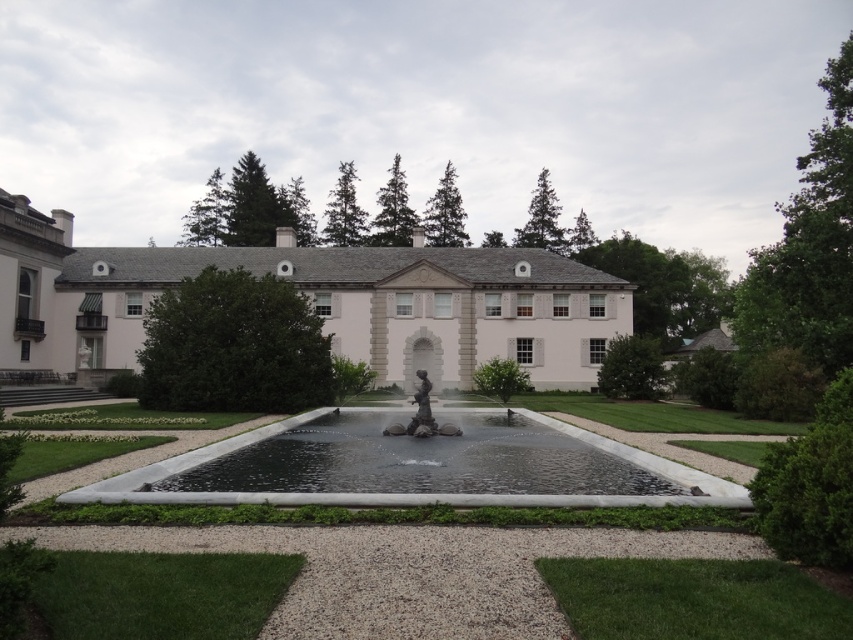
Question: Observing the image, what is the correct spatial positioning of white stone mansion at center in reference to clear glass water at center?

Choices:
 (A) left
 (B) right

Answer: (A)

Question: Which object appears closest to the camera in this image?

Choices:
 (A) white stone mansion at center
 (B) clear glass water at center

Answer: (B)

Question: Which point is closer to the camera?

Choices:
 (A) clear glass water at center
 (B) white stone mansion at center

Answer: (A)

Question: Can you confirm if white stone mansion at center is wider than clear glass water at center?

Choices:
 (A) no
 (B) yes

Answer: (B)

Question: Can you confirm if white stone mansion at center is wider than clear glass water at center?

Choices:
 (A) no
 (B) yes

Answer: (B)

Question: Which point appears closest to the camera in this image?

Choices:
 (A) (383, 474)
 (B) (544, 253)

Answer: (A)